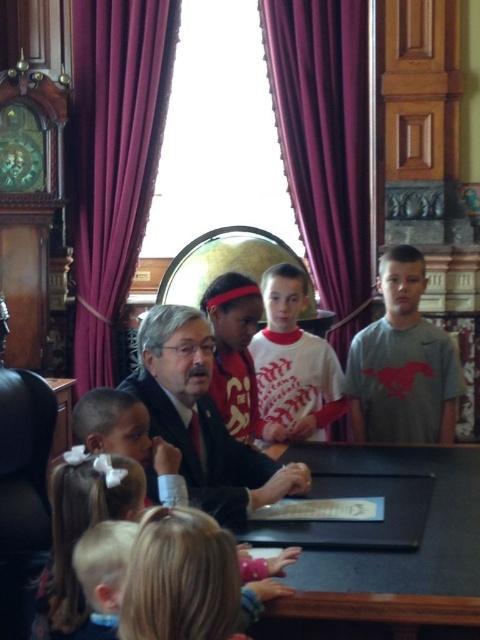
Describe the element at coordinates (115, 157) in the screenshot. I see `purple velvet curtain at left` at that location.

Image resolution: width=480 pixels, height=640 pixels. What are the coordinates of `purple velvet curtain at left` in the screenshot? It's located at (115, 157).

Which is more to the left, black glossy table at center or purple velvet curtain at upper center?

Positioned to the left is black glossy table at center.

Looking at this image, can you confirm if black glossy table at center is positioned below purple velvet curtain at upper center?

Yes.

Does point (408, 449) come behind point (320, 163)?

No, (408, 449) is closer to viewer.

Identify the location of black glossy table at center. The height and width of the screenshot is (640, 480). (383, 547).

Which of these two, black glossy table at center or matte red headband at center, stands taller?

matte red headband at center

Does black glossy table at center have a larger size compared to matte red headband at center?

Yes, black glossy table at center is bigger than matte red headband at center.

Describe the element at coordinates (383, 547) in the screenshot. Image resolution: width=480 pixels, height=640 pixels. I see `black glossy table at center` at that location.

Find the location of a particular element. black glossy table at center is located at coordinates (383, 547).